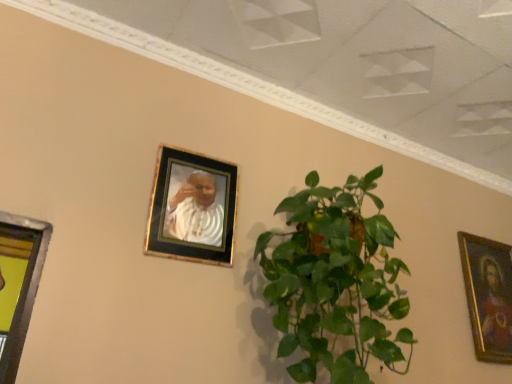
What do you see at coordinates (335, 281) in the screenshot?
I see `green leafy plant at center` at bounding box center [335, 281].

Find the location of `green leafy plant at center`. green leafy plant at center is located at coordinates (335, 281).

You are a GUI agent. You are given a task and a screenshot of the screen. Output one action in this format:
    pyautogui.click(x=<x>, y=<y>)
    Task: Click on the gold-framed painting at right, the 2th picture frame when ordered from front to back
    The height and width of the screenshot is (384, 512).
    Given the screenshot: What is the action you would take?
    pyautogui.click(x=488, y=295)

At what (x,y) coordinates should I click in order to perform the action: click on green leafy plant at center. Please return your answer as a coordinate pair (x, y). The width and height of the screenshot is (512, 384). Looking at the image, I should click on (335, 281).

Based on the photo, which is more to the right, green leafy plant at center or gold-framed photo at upper center, arranged as the first picture frame when viewed from the top?

green leafy plant at center is more to the right.

From the image's perspective, is green leafy plant at center located above gold-framed photo at upper center, positioned as the 1th picture frame in front-to-back order?

Actually, green leafy plant at center appears below gold-framed photo at upper center, positioned as the 1th picture frame in front-to-back order, in the image.

Would you say green leafy plant at center is a long distance from gold-framed photo at upper center, positioned as the 1th picture frame in front-to-back order?

green leafy plant at center is actually quite close to gold-framed photo at upper center, positioned as the 1th picture frame in front-to-back order.

The height and width of the screenshot is (384, 512). Identify the location of houseplant below the gold-framed photo at upper center, arranged as the first picture frame when viewed from the top (from the image's perspective). (335, 281).

Is gold-framed painting at right, arranged as the first picture frame when viewed from the back, located within green leafy plant at center?

No.

Who is shorter, green leafy plant at center or gold-framed painting at right, the 2th picture frame when ordered from front to back?

Standing shorter between the two is gold-framed painting at right, the 2th picture frame when ordered from front to back.

From a real-world perspective, is green leafy plant at center physically located above or below gold-framed painting at right, acting as the first picture frame starting from the bottom?

green leafy plant at center is below gold-framed painting at right, acting as the first picture frame starting from the bottom.

Is green leafy plant at center oriented away from gold-framed painting at right, the 2th picture frame when ordered from front to back?

green leafy plant at center is not turned away from gold-framed painting at right, the 2th picture frame when ordered from front to back.

In terms of size, does gold-framed painting at right, arranged as the first picture frame when viewed from the right, appear bigger or smaller than gold-framed photo at upper center, the second picture frame positioned from the back?

gold-framed painting at right, arranged as the first picture frame when viewed from the right, is bigger than gold-framed photo at upper center, the second picture frame positioned from the back.

Looking at their sizes, would you say gold-framed painting at right, arranged as the first picture frame when viewed from the back, is wider or thinner than gold-framed photo at upper center, placed as the 2th picture frame when sorted from bottom to top?

Considering their sizes, gold-framed painting at right, arranged as the first picture frame when viewed from the back, looks slimmer than gold-framed photo at upper center, placed as the 2th picture frame when sorted from bottom to top.

Between gold-framed painting at right, positioned as the second picture frame in left-to-right order, and gold-framed photo at upper center, the 2th picture frame positioned from the right, which one appears on the left side from the viewer's perspective?

Positioned to the left is gold-framed photo at upper center, the 2th picture frame positioned from the right.

How different are the orientations of gold-framed painting at right, which is the 2th picture frame in top-to-bottom order, and gold-framed photo at upper center, the second picture frame positioned from the back, in degrees?

gold-framed painting at right, which is the 2th picture frame in top-to-bottom order, and gold-framed photo at upper center, the second picture frame positioned from the back, are facing 0.0274 degrees away from each other.

Between point (197, 178) and point (357, 230), which one is positioned behind?

The point (197, 178) is more distant.

From the picture: Which object is positioned more to the right, gold-framed photo at upper center, positioned as the 1th picture frame in front-to-back order, or green leafy plant at center?

Positioned to the right is green leafy plant at center.

Does gold-framed photo at upper center, arranged as the first picture frame when viewed from the top, have a lesser width compared to green leafy plant at center?

Yes.

Is gold-framed photo at upper center, the second picture frame positioned from the back, positioned far away from green leafy plant at center?

No, gold-framed photo at upper center, the second picture frame positioned from the back, is not far away from green leafy plant at center.

Considering the relative sizes of gold-framed painting at right, arranged as the first picture frame when viewed from the right, and green leafy plant at center in the image provided, is gold-framed painting at right, arranged as the first picture frame when viewed from the right, bigger than green leafy plant at center?

No, gold-framed painting at right, arranged as the first picture frame when viewed from the right, is not bigger than green leafy plant at center.

Where is `picture frame on the right side of green leafy plant at center`? picture frame on the right side of green leafy plant at center is located at coordinates (488, 295).

From the image's perspective, is gold-framed painting at right, which is the 2th picture frame in top-to-bottom order, below green leafy plant at center?

Indeed, from the image's perspective, gold-framed painting at right, which is the 2th picture frame in top-to-bottom order, is shown beneath green leafy plant at center.

Can you tell me how much gold-framed painting at right, the 2th picture frame when ordered from front to back, and green leafy plant at center differ in facing direction?

They differ by 0.295 degrees in their facing directions.

Considering the relative sizes of gold-framed photo at upper center, placed as the 2th picture frame when sorted from bottom to top, and gold-framed painting at right, acting as the first picture frame starting from the bottom, in the image provided, is gold-framed photo at upper center, placed as the 2th picture frame when sorted from bottom to top, shorter than gold-framed painting at right, acting as the first picture frame starting from the bottom,?

Yes.

Is gold-framed photo at upper center, arranged as the first picture frame when viewed from the top, far from gold-framed painting at right, the 2th picture frame when ordered from front to back?

Indeed, gold-framed photo at upper center, arranged as the first picture frame when viewed from the top, is not near gold-framed painting at right, the 2th picture frame when ordered from front to back.

From a real-world perspective, who is located higher, gold-framed photo at upper center, positioned as the 1th picture frame in front-to-back order, or gold-framed painting at right, positioned as the second picture frame in left-to-right order?

gold-framed photo at upper center, positioned as the 1th picture frame in front-to-back order, from a real-world perspective.

Would you say gold-framed photo at upper center, the 2th picture frame positioned from the right, is inside or outside gold-framed painting at right, arranged as the first picture frame when viewed from the back?

gold-framed photo at upper center, the 2th picture frame positioned from the right, is outside gold-framed painting at right, arranged as the first picture frame when viewed from the back.

Starting from the green leafy plant at center, which picture frame is the 1st one behind? Please provide its 2D coordinates.

[(192, 208)]

Locate an element on the screen. houseplant below the gold-framed painting at right, arranged as the first picture frame when viewed from the back (from a real-world perspective) is located at coordinates (335, 281).

Considering their positions, is green leafy plant at center positioned closer to gold-framed photo at upper center, arranged as the first picture frame when viewed from the top, than gold-framed painting at right, arranged as the first picture frame when viewed from the back?

green leafy plant at center.

Based on their spatial positions, is green leafy plant at center or gold-framed photo at upper center, placed as the first picture frame when sorted from left to right, closer to gold-framed painting at right, arranged as the first picture frame when viewed from the right?

green leafy plant at center is closer to gold-framed painting at right, arranged as the first picture frame when viewed from the right.

Estimate the real-world distances between objects in this image. Which object is closer to green leafy plant at center, gold-framed photo at upper center, the 2th picture frame positioned from the right, or gold-framed painting at right, the 2th picture frame when ordered from front to back?

Based on the image, gold-framed photo at upper center, the 2th picture frame positioned from the right, appears to be nearer to green leafy plant at center.

When comparing their distances from gold-framed painting at right, the 2th picture frame when ordered from front to back, does gold-framed photo at upper center, the second picture frame positioned from the back, or green leafy plant at center seem closer?

The object closer to gold-framed painting at right, the 2th picture frame when ordered from front to back, is green leafy plant at center.

Based on the photo, which object lies nearer to the anchor point green leafy plant at center, gold-framed painting at right, which is the 2th picture frame in top-to-bottom order, or gold-framed photo at upper center, the 2th picture frame positioned from the right?

gold-framed photo at upper center, the 2th picture frame positioned from the right, is closer to green leafy plant at center.

When comparing their distances from gold-framed photo at upper center, the second picture frame positioned from the back, does gold-framed painting at right, the 2th picture frame when ordered from front to back, or green leafy plant at center seem further?

gold-framed painting at right, the 2th picture frame when ordered from front to back, is further to gold-framed photo at upper center, the second picture frame positioned from the back.

Where is `houseplant between gold-framed photo at upper center, placed as the first picture frame when sorted from left to right, and gold-framed painting at right, arranged as the first picture frame when viewed from the right`? The height and width of the screenshot is (384, 512). houseplant between gold-framed photo at upper center, placed as the first picture frame when sorted from left to right, and gold-framed painting at right, arranged as the first picture frame when viewed from the right is located at coordinates (335, 281).